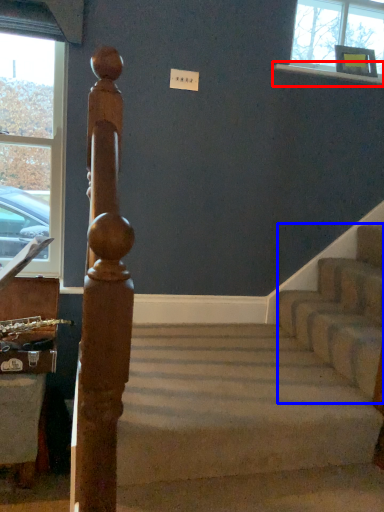
Question: Among these objects, which one is nearest to the camera, window sill (highlighted by a red box) or stairwell (highlighted by a blue box)?

Choices:
 (A) window sill
 (B) stairwell

Answer: (B)